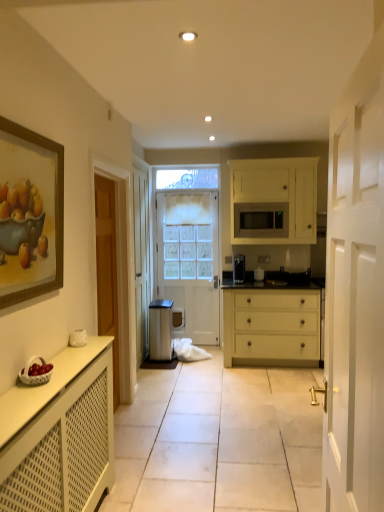
Image resolution: width=384 pixels, height=512 pixels. Find the location of `free point in front of white matte drawer at center`. free point in front of white matte drawer at center is located at coordinates (255, 384).